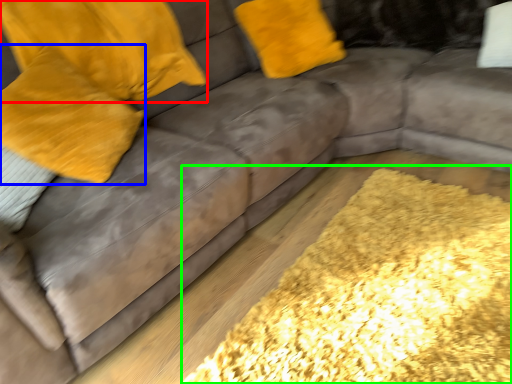
Question: Estimate the real-world distances between objects in this image. Which object is farther from pillow (highlighted by a red box), pillow (highlighted by a blue box) or mat (highlighted by a green box)?

Choices:
 (A) pillow
 (B) mat

Answer: (B)